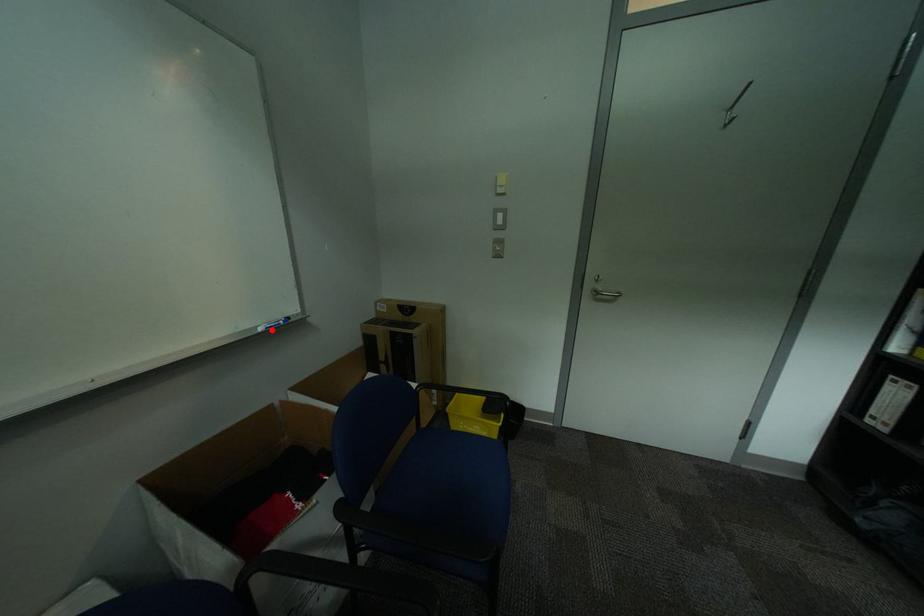
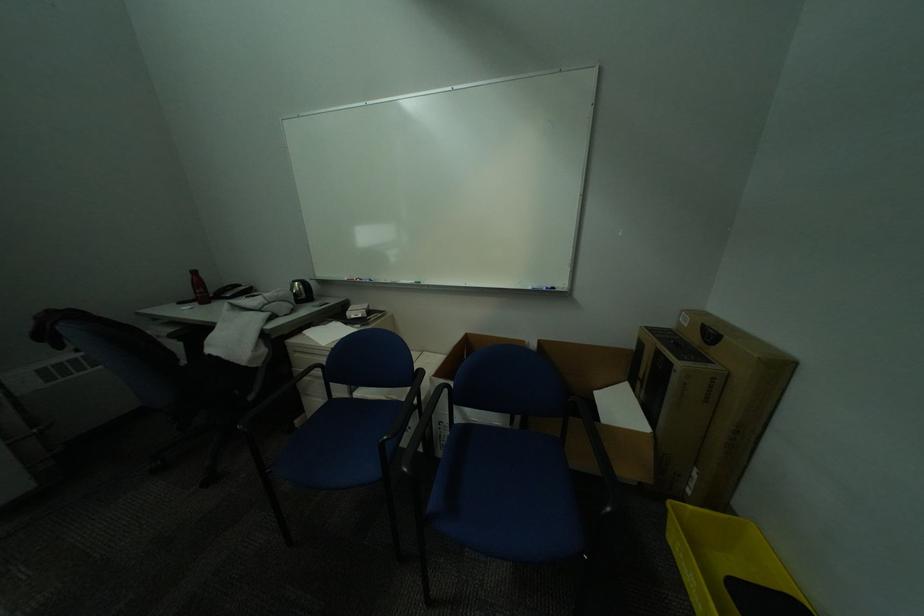
Locate, in the second image, the point that corresponds to the highlighted location in the first image.

(541, 289)